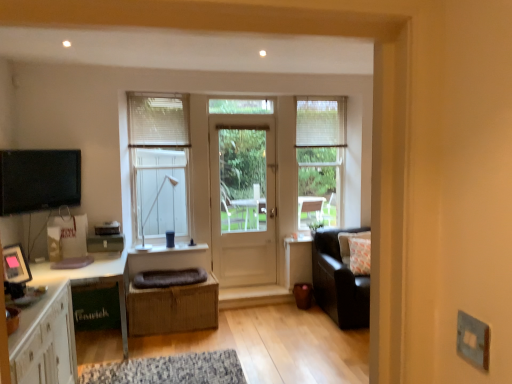
Question: Is matte black tv at left facing towards white wooden door at center?

Choices:
 (A) no
 (B) yes

Answer: (A)

Question: Considering the relative positions of matte black tv at left and white wooden door at center in the image provided, is matte black tv at left to the right of white wooden door at center from the viewer's perspective?

Choices:
 (A) no
 (B) yes

Answer: (A)

Question: Is matte black tv at left oriented away from white wooden door at center?

Choices:
 (A) yes
 (B) no

Answer: (B)

Question: From a real-world perspective, does matte black tv at left sit lower than white wooden door at center?

Choices:
 (A) yes
 (B) no

Answer: (B)

Question: From a real-world perspective, is matte black tv at left on top of white wooden door at center?

Choices:
 (A) no
 (B) yes

Answer: (B)

Question: Are matte black tv at left and white wooden door at center making contact?

Choices:
 (A) yes
 (B) no

Answer: (B)

Question: From a real-world perspective, is white wooden door at center located higher than clear glass door at center, arranged as the second window when viewed from the right?

Choices:
 (A) yes
 (B) no

Answer: (B)

Question: Can you confirm if white wooden door at center is bigger than clear glass door at center, arranged as the second window when viewed from the right?

Choices:
 (A) yes
 (B) no

Answer: (A)

Question: Would you say white wooden door at center is outside clear glass door at center, the 2th window from the left?

Choices:
 (A) no
 (B) yes

Answer: (B)

Question: Is white wooden door at center positioned in front of clear glass door at center, the 2th window from the left?

Choices:
 (A) yes
 (B) no

Answer: (B)

Question: Is white wooden door at center with clear glass door at center, arranged as the second window when viewed from the right?

Choices:
 (A) no
 (B) yes

Answer: (A)

Question: From the image's perspective, is white wooden door at center below clear glass door at center, arranged as the second window when viewed from the right?

Choices:
 (A) yes
 (B) no

Answer: (A)

Question: Is brown woven crate at center oriented away from matte white lamp at upper center?

Choices:
 (A) yes
 (B) no

Answer: (B)